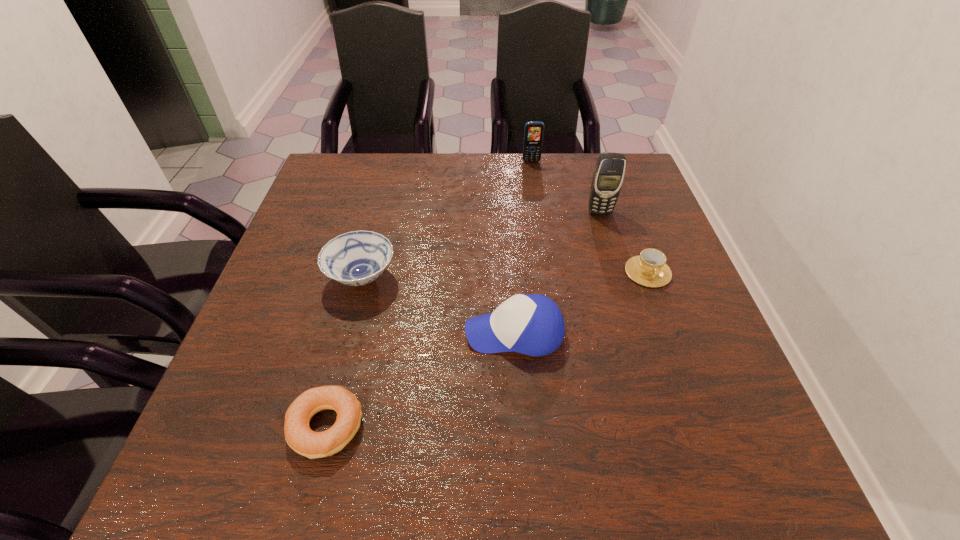
This screenshot has height=540, width=960. I want to click on the fifth nearest object, so click(x=608, y=176).

The image size is (960, 540). In order to click on the tallest object in this screenshot , I will do `click(608, 176)`.

Image resolution: width=960 pixels, height=540 pixels. In order to click on the farther cellular telephone in this screenshot , I will do `click(533, 133)`.

The height and width of the screenshot is (540, 960). I want to click on the farthest object, so click(533, 133).

The width and height of the screenshot is (960, 540). Find the location of `the second nearest object`. the second nearest object is located at coordinates (532, 324).

Locate an element on the screen. the third shortest object is located at coordinates (356, 258).

Identify the location of cup. The height and width of the screenshot is (540, 960). (649, 269).

Locate an element on the screen. The width and height of the screenshot is (960, 540). bagel is located at coordinates (298, 435).

Locate an element on the screen. vacant space situated on the front face of the tallest object is located at coordinates (614, 259).

Image resolution: width=960 pixels, height=540 pixels. I want to click on vacant position located 0.140m on the screen of the shorter cellular telephone, so click(x=536, y=190).